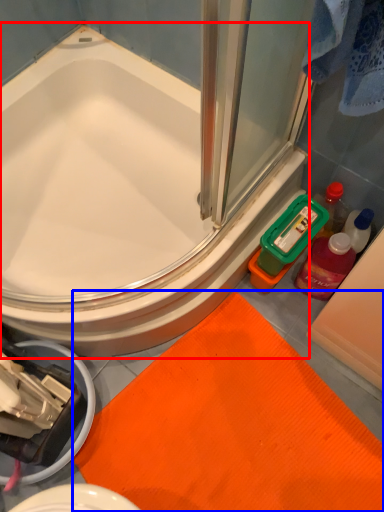
Question: Which of the following is the closest to the observer, bathtub (highlighted by a red box) or bath mat (highlighted by a blue box)?

Choices:
 (A) bathtub
 (B) bath mat

Answer: (A)